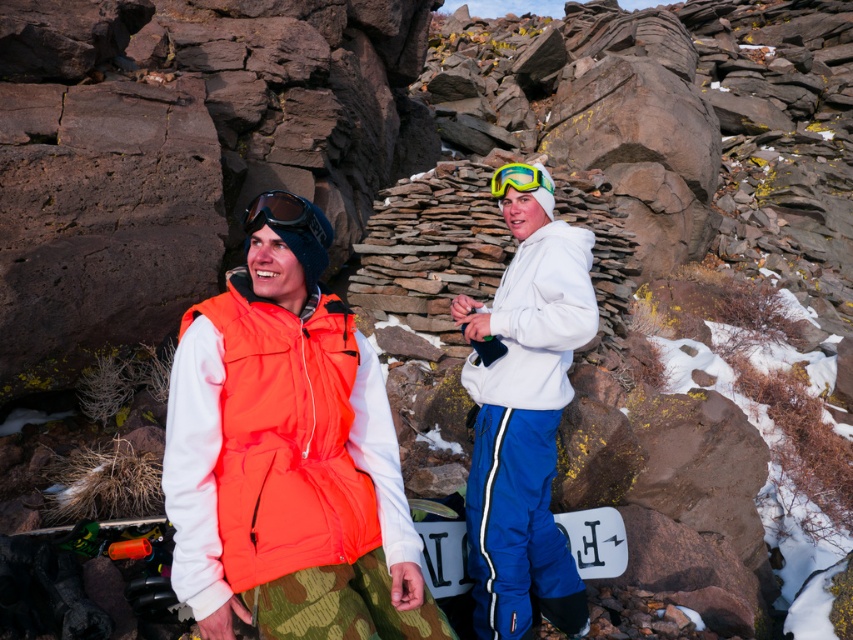
Question: Which object is positioned farthest from the neon orange softshell vest at center?

Choices:
 (A) yellow-green plastic goggles at upper center
 (B) matte blue goggles at center
 (C) white fleece jacket at center

Answer: (A)

Question: Is neon orange softshell vest at center behind yellow-green plastic goggles at upper center?

Choices:
 (A) yes
 (B) no

Answer: (B)

Question: Estimate the real-world distances between objects in this image. Which object is closer to the yellow-green plastic goggles at upper center?

Choices:
 (A) white fleece jacket at center
 (B) matte blue goggles at center
 (C) neon orange softshell vest at center

Answer: (A)

Question: Which point appears closest to the camera in this image?

Choices:
 (A) (274, 225)
 (B) (368, 368)
 (C) (573, 241)
 (D) (525, 164)

Answer: (A)

Question: Considering the relative positions of neon orange softshell vest at center and yellow-green plastic goggles at upper center in the image provided, where is neon orange softshell vest at center located with respect to yellow-green plastic goggles at upper center?

Choices:
 (A) right
 (B) left

Answer: (B)

Question: Can you confirm if neon orange softshell vest at center is smaller than matte blue goggles at center?

Choices:
 (A) yes
 (B) no

Answer: (B)